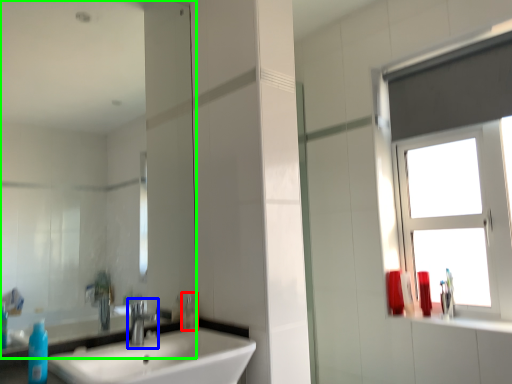
Question: Estimate the real-world distances between objects in this image. Which object is closer to toiletry (highlighted by a red box), tap (highlighted by a blue box) or mirror (highlighted by a green box)?

Choices:
 (A) tap
 (B) mirror

Answer: (A)